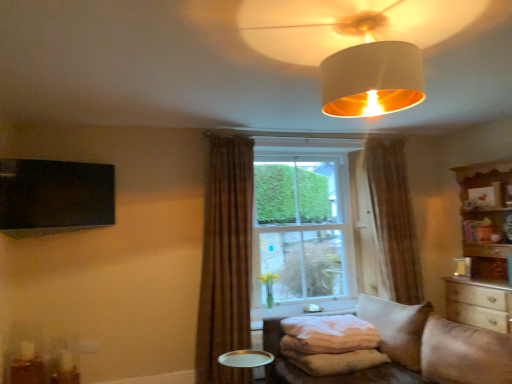
Question: In the image, is white fabric lampshade at upper center on the left side or the right side of white soft pillow at lower center?

Choices:
 (A) right
 (B) left

Answer: (B)

Question: Is white fabric lampshade at upper center in front of or behind white soft pillow at lower center in the image?

Choices:
 (A) front
 (B) behind

Answer: (A)

Question: Estimate the real-world distances between objects in this image. Which object is farther from the wooden cabinet at right?

Choices:
 (A) brown textured curtain at center, which is counted as the 2th curtain, starting from the back
 (B) clear glass window at center
 (C) beige fabric studio couch at lower right
 (D) metallic silver tray at lower center
 (E) white soft pillow at lower center

Answer: (D)

Question: Based on their relative distances, which object is farther from the clear glass window at center?

Choices:
 (A) brown sheer curtain at center, placed as the 1th curtain when sorted from back to front
 (B) white fabric lampshade at upper center
 (C) metallic silver tray at lower center
 (D) wooden cabinet at right
 (E) white soft pillow at lower center

Answer: (B)